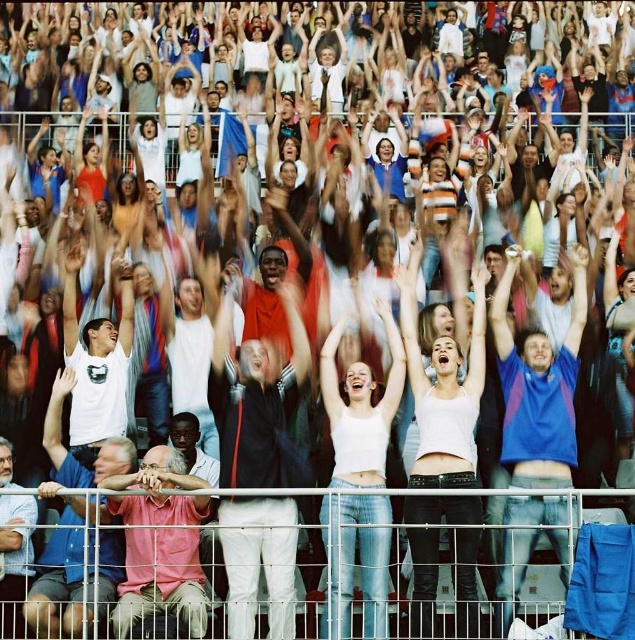
From the picture: You are a photographer trying to capture a closeup of the blue cotton shirt at center. You notice a point at coordinates (538, 385) in your viewfinder. Is this point located on the blue cotton shirt at center?

Yes, the point at coordinates (538, 385) is located on the blue cotton shirt at center according to the description.